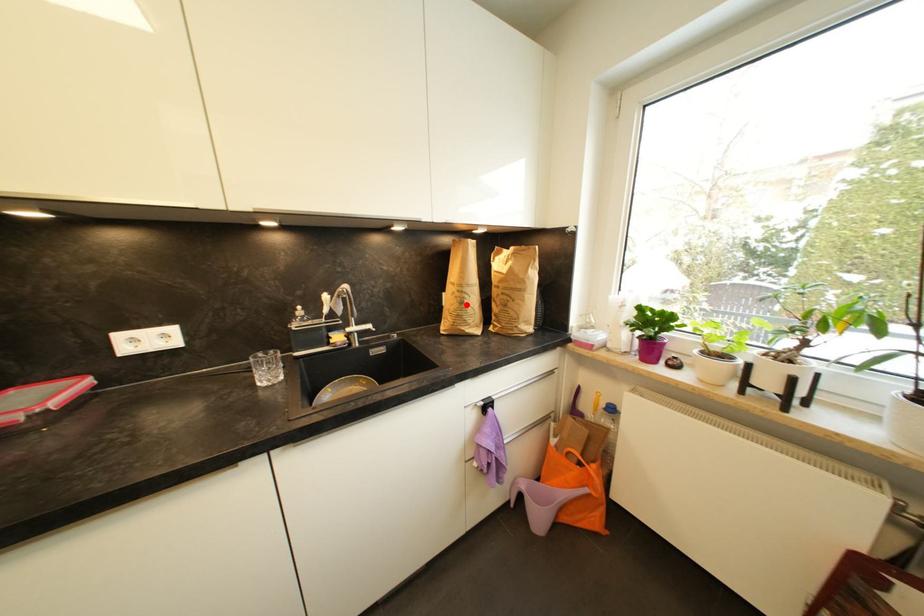
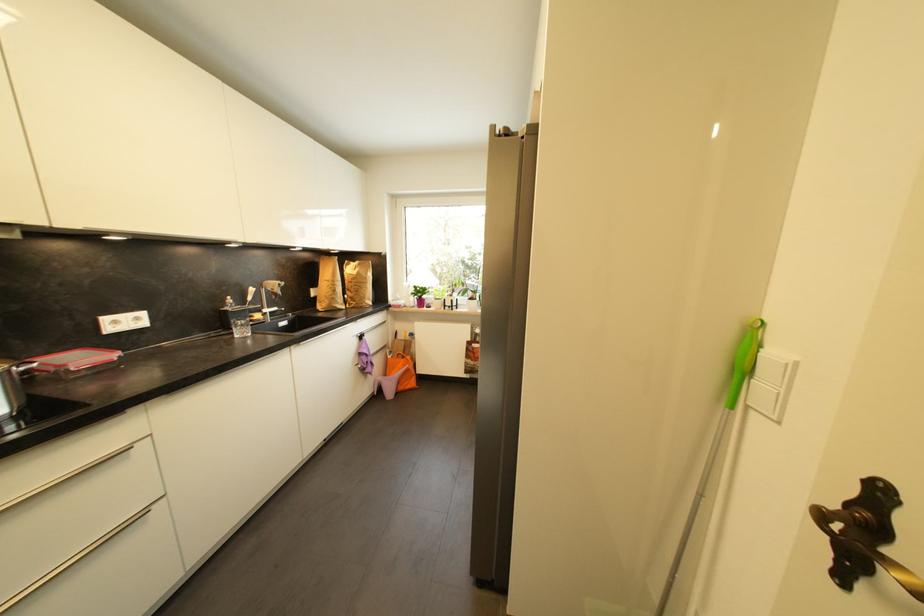
In the second image, find the point that corresponds to the highlighted location in the first image.

(339, 293)